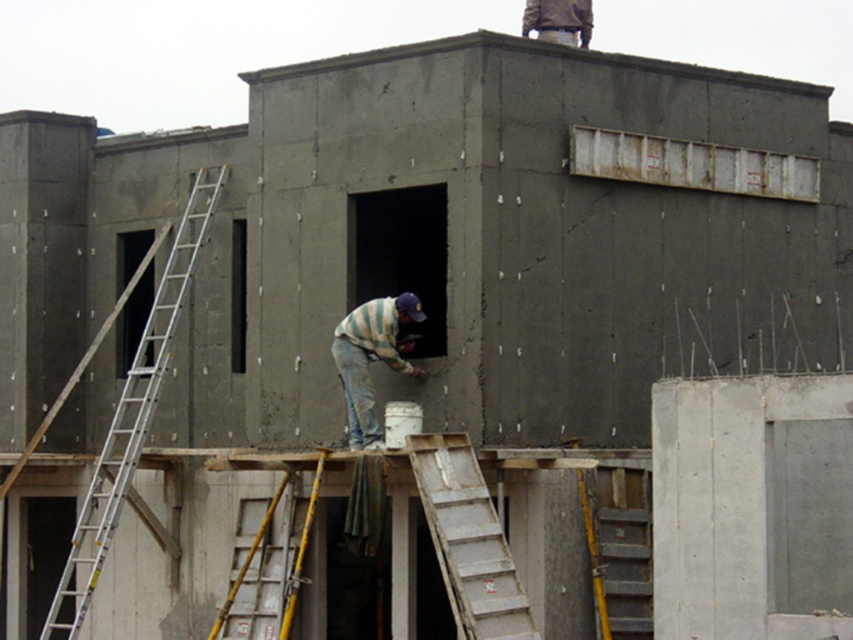
Question: Does striped sweater at center come in front of yellow/yellowish metal ladder at center?

Choices:
 (A) no
 (B) yes

Answer: (B)

Question: Which is nearer to the silver metallic ladder at left?

Choices:
 (A) wooden step ladder at center
 (B) striped sweater at center
 (C) yellow/yellowish metal ladder at center

Answer: (C)

Question: Estimate the real-world distances between objects in this image. Which object is closer to the striped sweater at center?

Choices:
 (A) silver metallic ladder at left
 (B) wooden step ladder at center
 (C) yellow/yellowish metal ladder at center

Answer: (C)

Question: Does silver metallic ladder at left have a lesser width compared to yellow/yellowish metal ladder at center?

Choices:
 (A) yes
 (B) no

Answer: (B)

Question: Does wooden step ladder at center have a lesser width compared to yellow/yellowish metal ladder at center?

Choices:
 (A) yes
 (B) no

Answer: (B)

Question: Estimate the real-world distances between objects in this image. Which object is closer to the striped sweater at center?

Choices:
 (A) yellow/yellowish metal ladder at center
 (B) silver metallic ladder at left

Answer: (A)